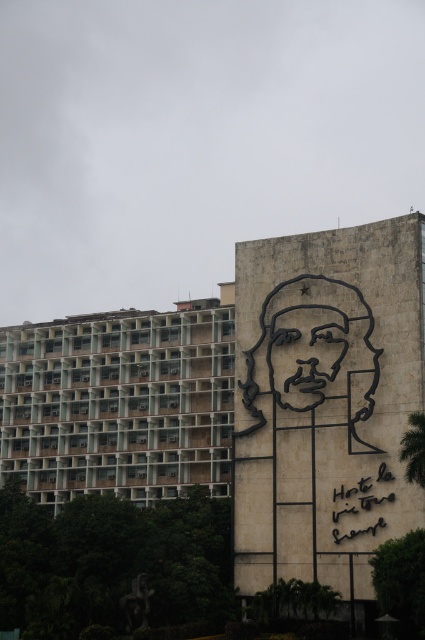
Does concrete building at left have a lesser height compared to black line drawing face at center?

No, concrete building at left is not shorter than black line drawing face at center.

Between point (152, 323) and point (331, 365), which one is positioned in front?

Point (331, 365) is in front.

You are a GUI agent. You are given a task and a screenshot of the screen. Output one action in this format:
    pyautogui.click(x=<x>, y=<y>)
    Task: Click on the concrete building at left
    This screenshot has height=640, width=425.
    Given the screenshot: What is the action you would take?
    pyautogui.click(x=119, y=403)